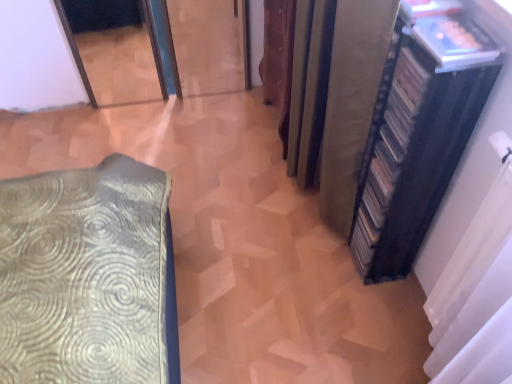
Image resolution: width=512 pixels, height=384 pixels. Find the location of `free space to the left of silky beige curtain at right, placed as the 2th curtain when sorted from right to left`. free space to the left of silky beige curtain at right, placed as the 2th curtain when sorted from right to left is located at coordinates (240, 208).